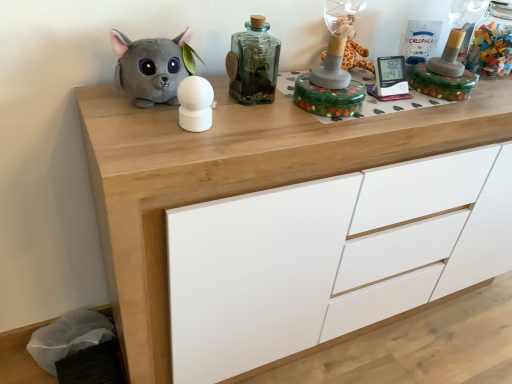
You are a GUI agent. You are given a task and a screenshot of the screen. Output one action in this format:
    pyautogui.click(x=<x>, y=<y>)
    Task: Click on the vacant space in between green floral box at center, acting as the 1th toy starting from the right, and translucent glass bottle at center, the 1th bottle positioned from the front
    Image resolution: width=512 pixels, height=384 pixels.
    Given the screenshot: What is the action you would take?
    pyautogui.click(x=278, y=107)